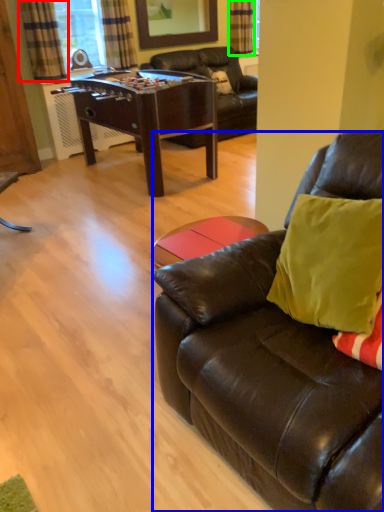
Question: Which object is the closest to the curtain (highlighted by a red box)? Choose among these: studio couch (highlighted by a blue box) or curtain (highlighted by a green box).

Choices:
 (A) studio couch
 (B) curtain

Answer: (B)